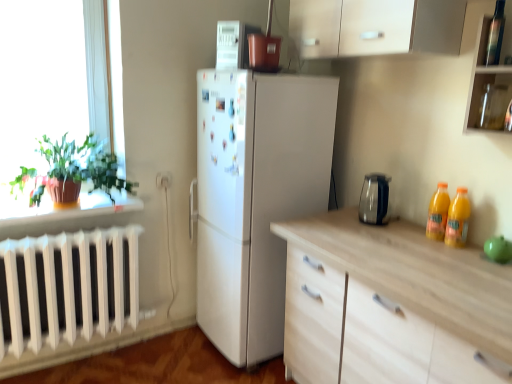
Question: Is yellow glass bottles at right, the 3th bottle in the top-to-bottom sequence, positioned behind transparent glass jar at upper right?

Choices:
 (A) no
 (B) yes

Answer: (B)

Question: From the image's perspective, does yellow glass bottles at right, the second bottle in the back-to-front sequence, appear higher than transparent glass jar at upper right?

Choices:
 (A) yes
 (B) no

Answer: (B)

Question: Is yellow glass bottles at right, which is the second bottle from front to back, thinner than transparent glass jar at upper right?

Choices:
 (A) yes
 (B) no

Answer: (A)

Question: Can we say yellow glass bottles at right, which is the second bottle from front to back, lies outside transparent glass jar at upper right?

Choices:
 (A) no
 (B) yes

Answer: (B)

Question: Is transparent glass jar at upper right a part of yellow glass bottles at right, the first bottle ordered from the bottom?

Choices:
 (A) no
 (B) yes

Answer: (A)

Question: Does point (157, 175) appear closer or farther from the camera than point (116, 162)?

Choices:
 (A) farther
 (B) closer

Answer: (A)

Question: Considering the positions of white plastic electric outlet at lower center and green matte plant at left in the image, is white plastic electric outlet at lower center taller or shorter than green matte plant at left?

Choices:
 (A) tall
 (B) short

Answer: (B)

Question: From a real-world perspective, is white plastic electric outlet at lower center positioned above or below green matte plant at left?

Choices:
 (A) above
 (B) below

Answer: (B)

Question: Considering the positions of white plastic electric outlet at lower center and green matte plant at left in the image, is white plastic electric outlet at lower center wider or thinner than green matte plant at left?

Choices:
 (A) wide
 (B) thin

Answer: (B)

Question: Considering the positions of white glossy microwave at upper center and transparent glass jar at upper right in the image, is white glossy microwave at upper center bigger or smaller than transparent glass jar at upper right?

Choices:
 (A) small
 (B) big

Answer: (B)

Question: In the image, is white glossy microwave at upper center on the left side or the right side of transparent glass jar at upper right?

Choices:
 (A) right
 (B) left

Answer: (B)

Question: In the image, is white glossy microwave at upper center positioned in front of or behind transparent glass jar at upper right?

Choices:
 (A) front
 (B) behind

Answer: (B)

Question: From a real-world perspective, is white glossy microwave at upper center physically located above or below transparent glass jar at upper right?

Choices:
 (A) above
 (B) below

Answer: (A)

Question: Is orange plastic bottles at right, which is the third bottle from front to back, taller or shorter than green matte plant at left?

Choices:
 (A) tall
 (B) short

Answer: (B)

Question: Is orange plastic bottles at right, which is counted as the 2th bottle, starting from the top, bigger or smaller than green matte plant at left?

Choices:
 (A) small
 (B) big

Answer: (A)